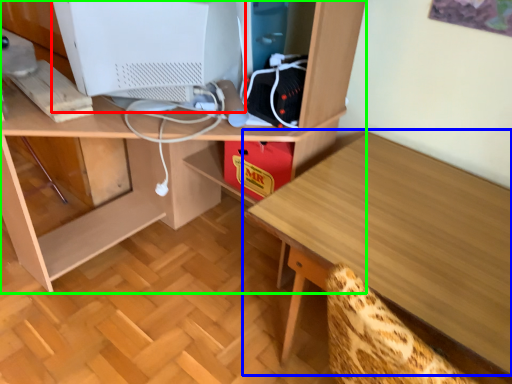
Question: Estimate the real-world distances between objects in this image. Which object is farther from computer monitor (highlighted by a red box), table (highlighted by a blue box) or desk (highlighted by a green box)?

Choices:
 (A) table
 (B) desk

Answer: (A)